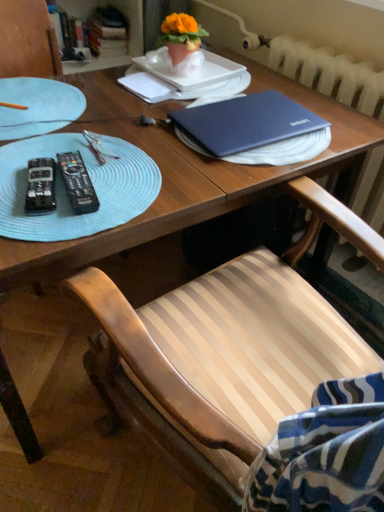
Locate an element on the screen. This screenshot has width=384, height=512. free space to the back side of black plastic remote control at left, the first remote control viewed from the right is located at coordinates [x=97, y=144].